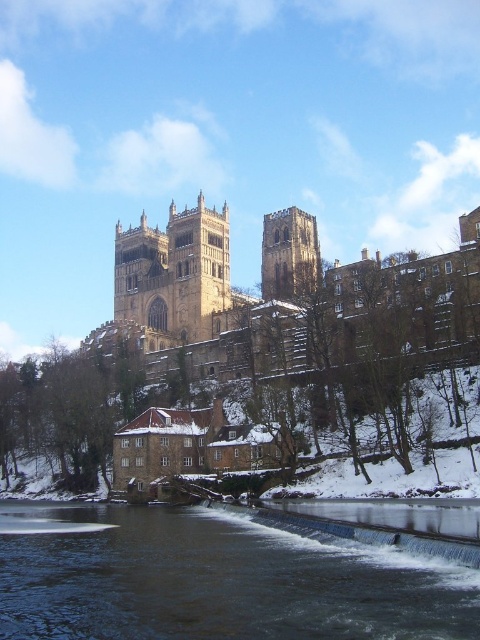
Is point (184, 342) positioned before point (264, 273)?

Yes, point (184, 342) is in front of point (264, 273).

Can you confirm if golden stone tower at center is positioned above brown stone tower at center?

No.

What do you see at coordinates (172, 275) in the screenshot? Image resolution: width=480 pixels, height=640 pixels. I see `golden stone tower at center` at bounding box center [172, 275].

Locate an element on the screen. golden stone tower at center is located at coordinates (172, 275).

Which is in front, point (52, 531) or point (400, 273)?

Positioned in front is point (52, 531).

Does point (331, 576) come farther from viewer compared to point (276, 349)?

No, it is in front of (276, 349).

Describe the element at coordinates (214, 579) in the screenshot. This screenshot has width=480, height=640. I see `dark gray water at lower center` at that location.

At what (x,y) coordinates should I click in order to perform the action: click on dark gray water at lower center. Please return your answer as a coordinate pair (x, y). The width and height of the screenshot is (480, 640). Looking at the image, I should click on (214, 579).

Can you confirm if golden stone castle at center is shorter than golden stone tower at center?

In fact, golden stone castle at center may be taller than golden stone tower at center.

Does golden stone castle at center appear on the left side of golden stone tower at center?

Incorrect, golden stone castle at center is not on the left side of golden stone tower at center.

This screenshot has height=640, width=480. I want to click on golden stone castle at center, so click(x=273, y=294).